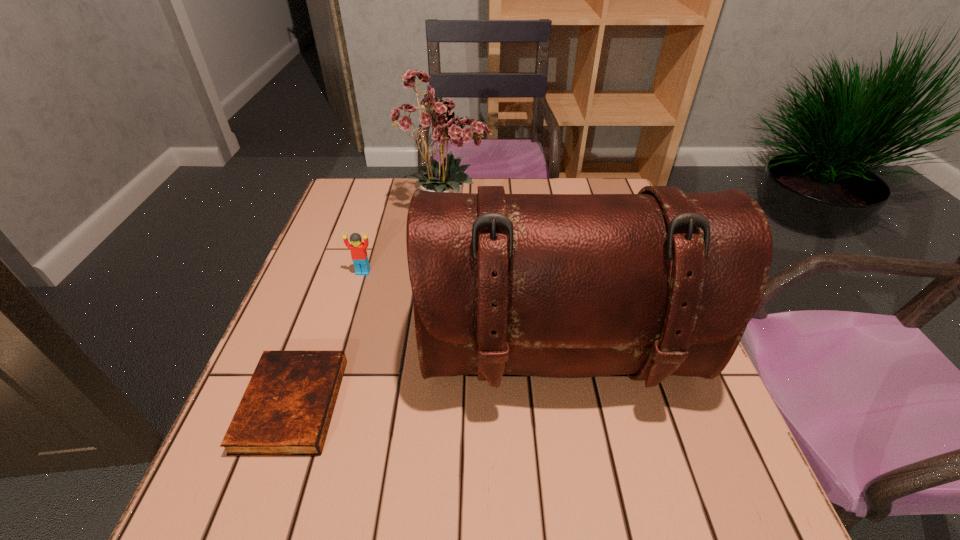
Find the location of a particular element. Image resolution: width=960 pixels, height=540 pixels. the farthest object is located at coordinates (437, 124).

This screenshot has height=540, width=960. What are the coordinates of `satchel` in the screenshot? It's located at (659, 283).

Identify the location of the second shortest object. This screenshot has width=960, height=540. (358, 248).

The height and width of the screenshot is (540, 960). In order to click on the second farthest object in this screenshot , I will do `click(358, 248)`.

The height and width of the screenshot is (540, 960). Find the location of `Bible`. Bible is located at coordinates (286, 409).

This screenshot has width=960, height=540. What are the coordinates of `free space located on the front-facing side of the farthest object` in the screenshot? It's located at (536, 212).

I want to click on free space located 0.060m on the front-facing side of the satchel, so click(x=574, y=450).

Image resolution: width=960 pixels, height=540 pixels. Identify the location of free space located 0.320m on the face of the second shortest object. (329, 383).

Find the location of a particular element. Image resolution: width=960 pixels, height=540 pixels. vacant region located on the spine side of the Bible is located at coordinates (399, 404).

Identify the location of object that is positioned at the far edge. (437, 124).